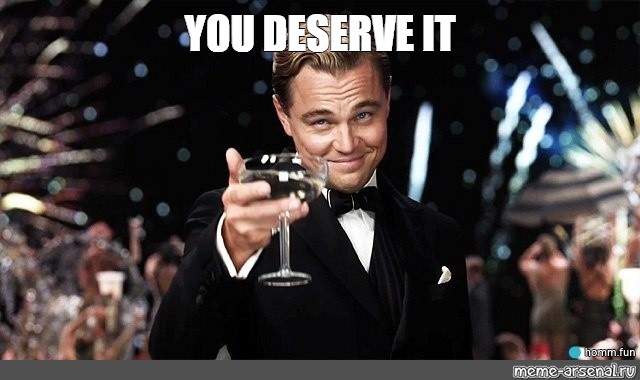
The height and width of the screenshot is (380, 640). Identify the location of wine glass handle. (284, 254).